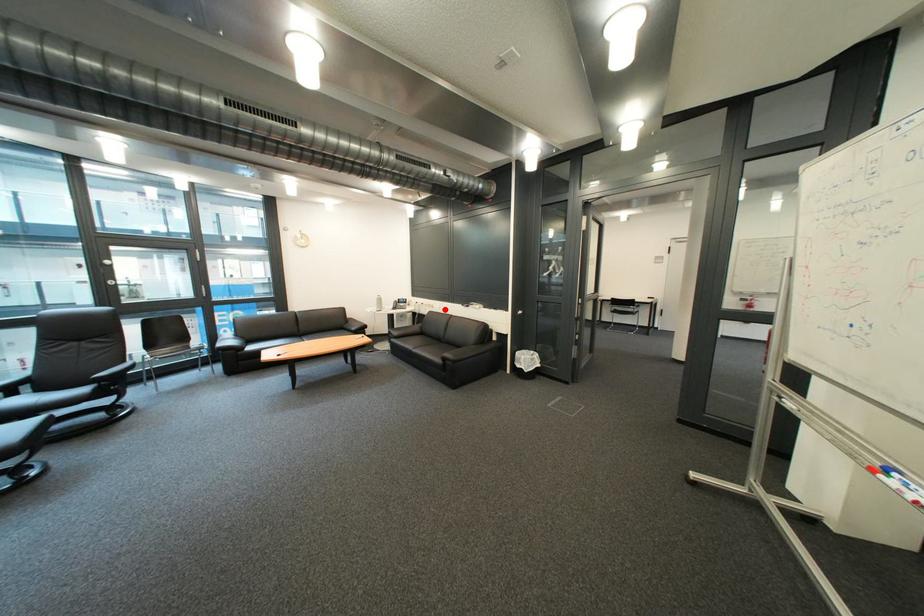
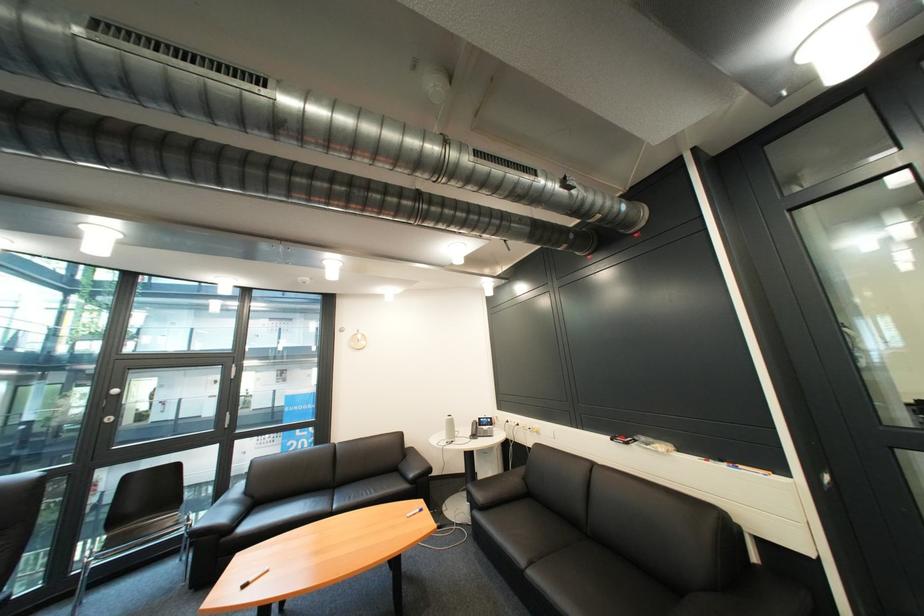
In the second image, find the point that corresponds to the highlighted location in the first image.

(549, 435)